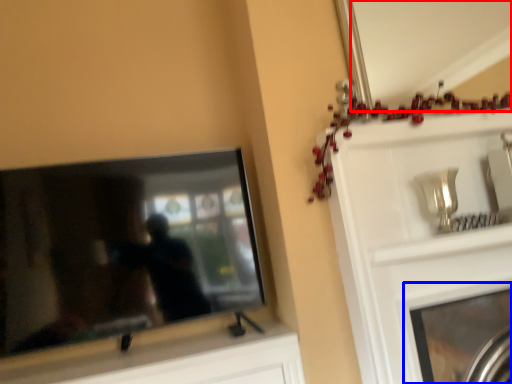
Question: Which of the following is the farthest to the observer, mirror (highlighted by a red box) or fireplace (highlighted by a blue box)?

Choices:
 (A) mirror
 (B) fireplace

Answer: (A)